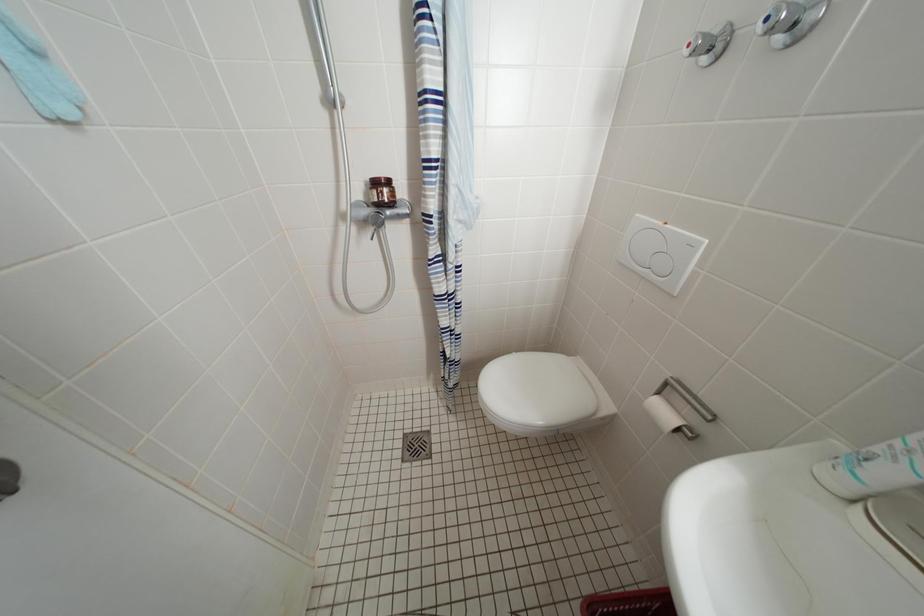
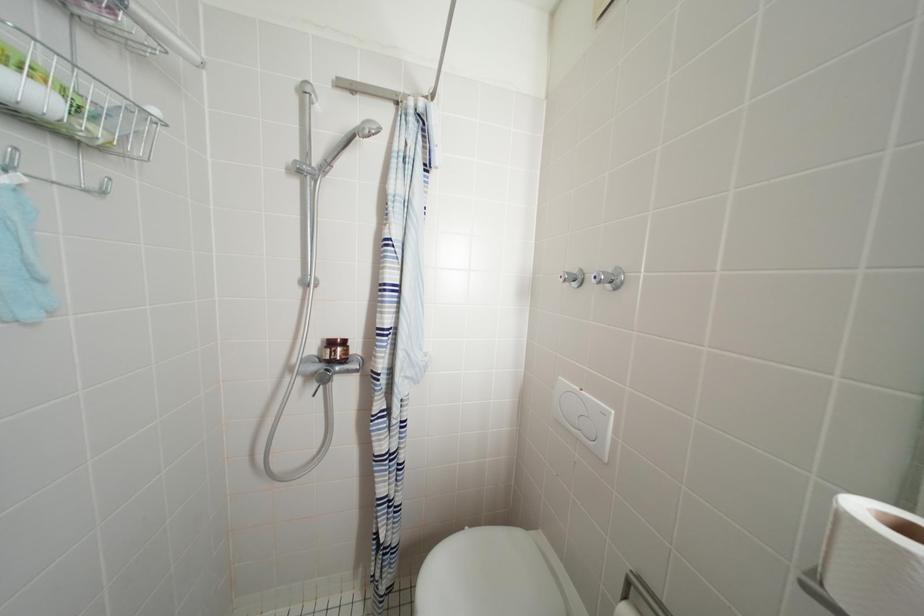
Question: Based on the continuous images, in which direction is the camera rotating? Reply with the corresponding letter.

Choices:
 (A) Left
 (B) Right
 (C) Up
 (D) Down

Answer: (C)